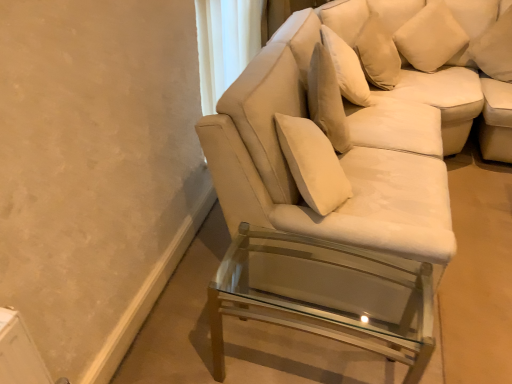
Question: From a real-world perspective, is white soft cushion at upper right, which ranks as the second pillow in right-to-left order, under clear glass table at lower right?

Choices:
 (A) no
 (B) yes

Answer: (A)

Question: From the image's perspective, would you say white soft cushion at upper right, which ranks as the first pillow in left-to-right order, is positioned over clear glass table at lower right?

Choices:
 (A) yes
 (B) no

Answer: (A)

Question: From a real-world perspective, is white soft cushion at upper right, which ranks as the first pillow in left-to-right order, physically above clear glass table at lower right?

Choices:
 (A) yes
 (B) no

Answer: (A)

Question: Does white soft cushion at upper right, which ranks as the first pillow in left-to-right order, come in front of clear glass table at lower right?

Choices:
 (A) yes
 (B) no

Answer: (B)

Question: Considering the relative sizes of white soft cushion at upper right, which ranks as the first pillow in left-to-right order, and clear glass table at lower right in the image provided, is white soft cushion at upper right, which ranks as the first pillow in left-to-right order, taller than clear glass table at lower right?

Choices:
 (A) yes
 (B) no

Answer: (B)

Question: Considering the relative sizes of white soft cushion at upper right, which ranks as the first pillow in left-to-right order, and clear glass table at lower right in the image provided, is white soft cushion at upper right, which ranks as the first pillow in left-to-right order, thinner than clear glass table at lower right?

Choices:
 (A) yes
 (B) no

Answer: (A)

Question: Could you tell me if clear glass table at lower right is facing white soft cushion at upper right, which ranks as the second pillow in right-to-left order?

Choices:
 (A) no
 (B) yes

Answer: (A)

Question: Is clear glass table at lower right turned away from white soft cushion at upper right, which ranks as the first pillow in left-to-right order?

Choices:
 (A) yes
 (B) no

Answer: (B)

Question: Can you confirm if clear glass table at lower right is positioned to the right of white soft cushion at upper right, which ranks as the first pillow in left-to-right order?

Choices:
 (A) yes
 (B) no

Answer: (B)

Question: Are clear glass table at lower right and white soft cushion at upper right, which ranks as the second pillow in right-to-left order, far apart?

Choices:
 (A) no
 (B) yes

Answer: (B)

Question: Considering the relative sizes of clear glass table at lower right and white soft cushion at upper right, which ranks as the second pillow in right-to-left order, in the image provided, is clear glass table at lower right taller than white soft cushion at upper right, which ranks as the second pillow in right-to-left order,?

Choices:
 (A) no
 (B) yes

Answer: (B)

Question: Can you confirm if clear glass table at lower right is wider than white soft cushion at upper right, which ranks as the second pillow in right-to-left order?

Choices:
 (A) yes
 (B) no

Answer: (A)

Question: Does white fabric couch at center appear on the left side of white soft cushion at upper right, arranged as the first pillow when viewed from the right?

Choices:
 (A) no
 (B) yes

Answer: (B)